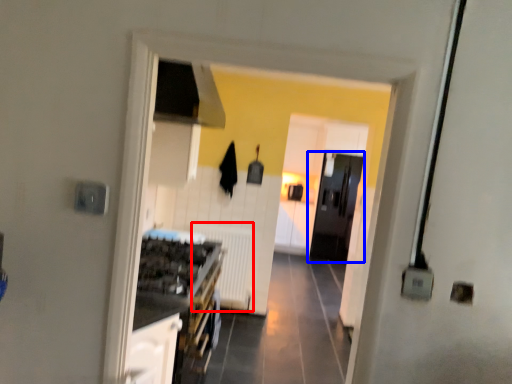
Question: Which object appears farthest to the camera in this image, radiator (highlighted by a red box) or door (highlighted by a blue box)?

Choices:
 (A) radiator
 (B) door

Answer: (B)